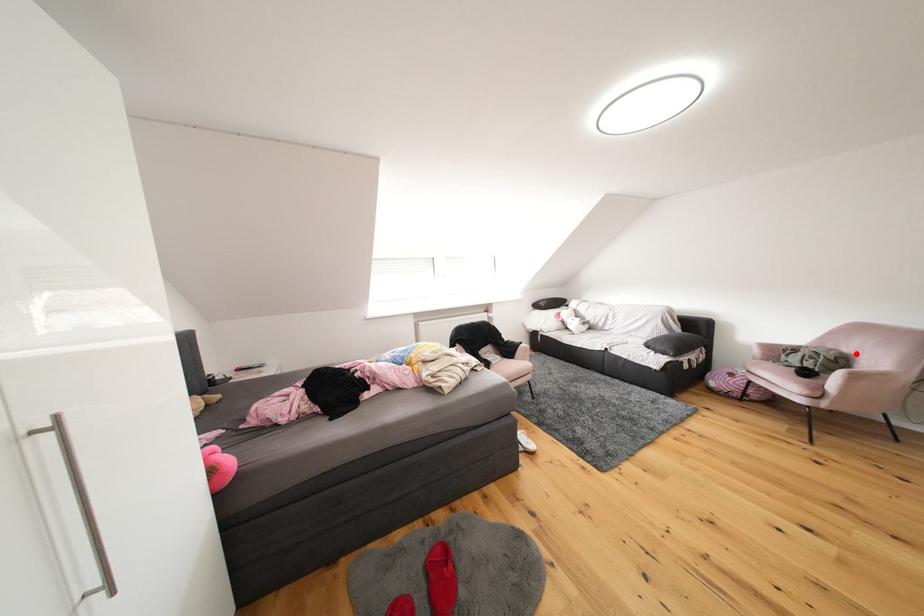
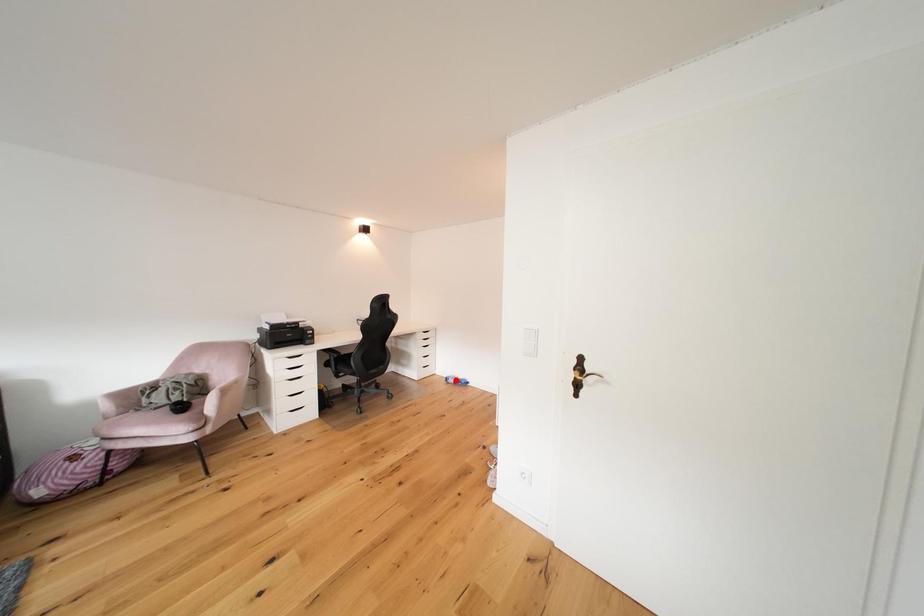
I am providing you with two images of the same scene from different viewpoints. A red point is marked on the first image and another point is marked on the second image. Are the points marked in image1 and image2 representing the same 3D position?

No